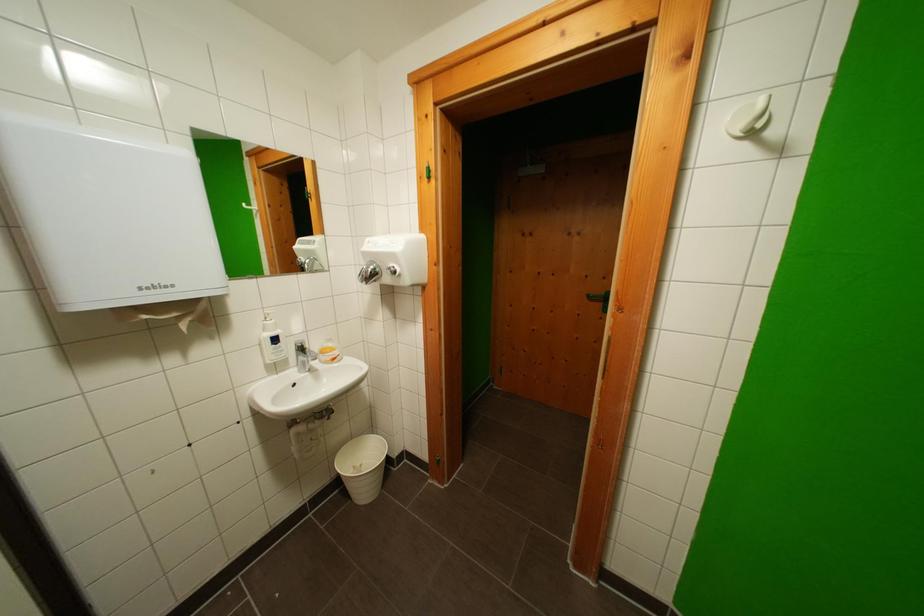
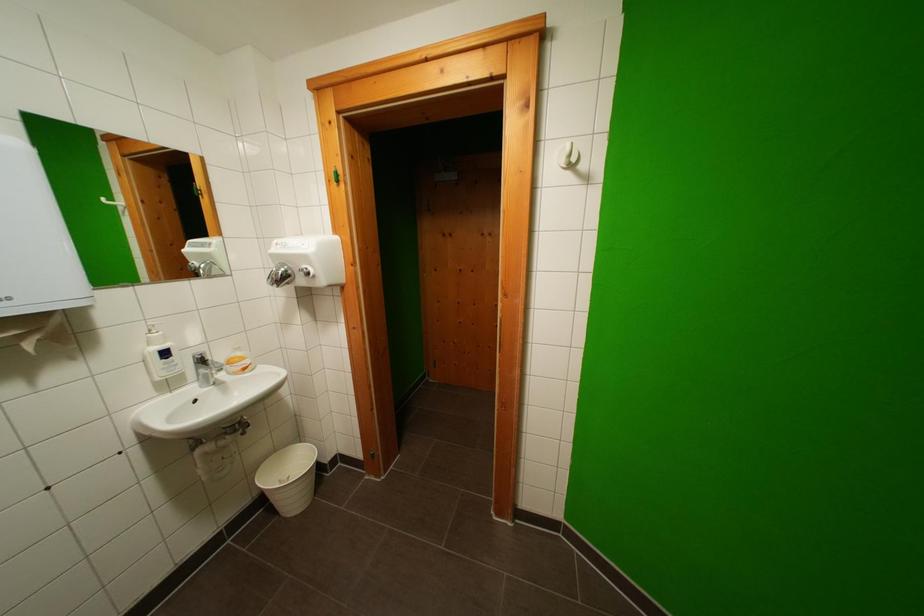
The point at (746, 132) is marked in the first image. Where is the corresponding point in the second image?

(569, 164)